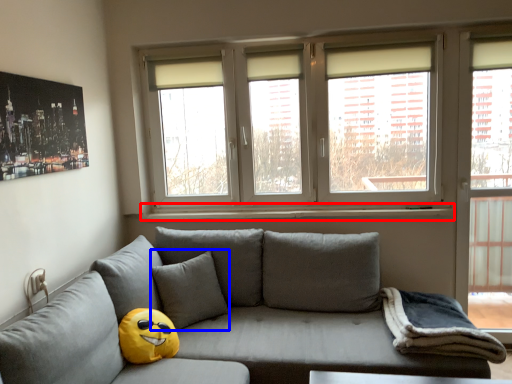
Question: Which point is further to the camera, window sill (highlighted by a red box) or pillow (highlighted by a blue box)?

Choices:
 (A) window sill
 (B) pillow

Answer: (A)